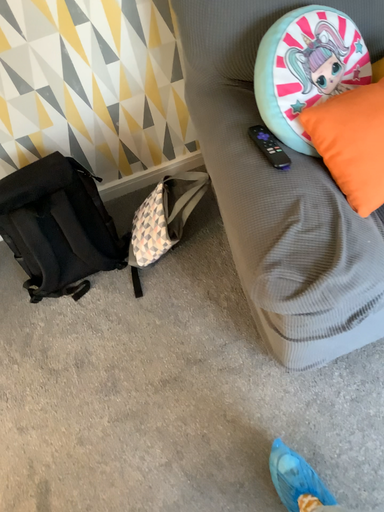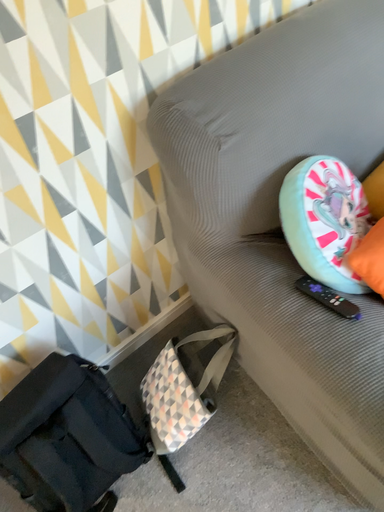
Question: Which way did the camera rotate in the video?

Choices:
 (A) rotated left
 (B) rotated right

Answer: (B)